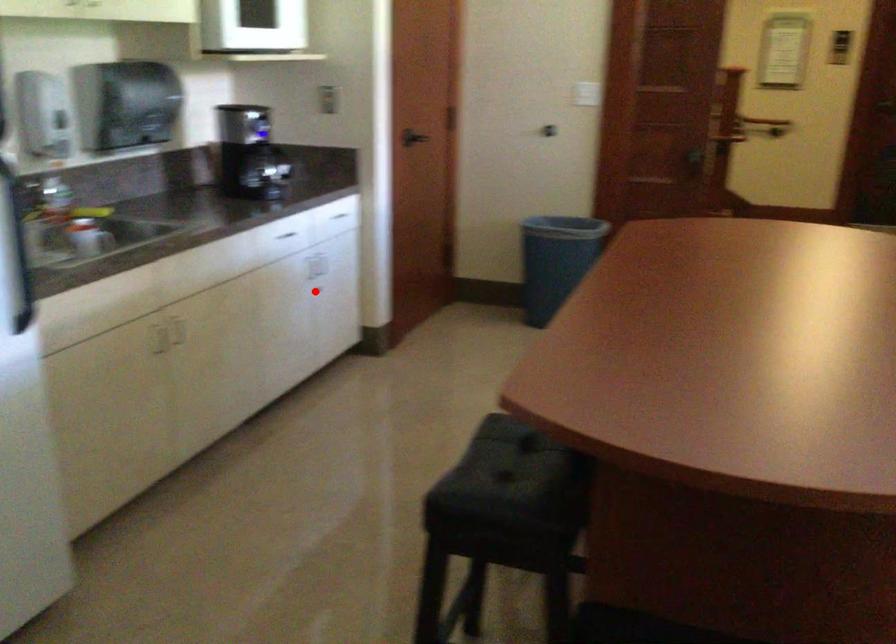
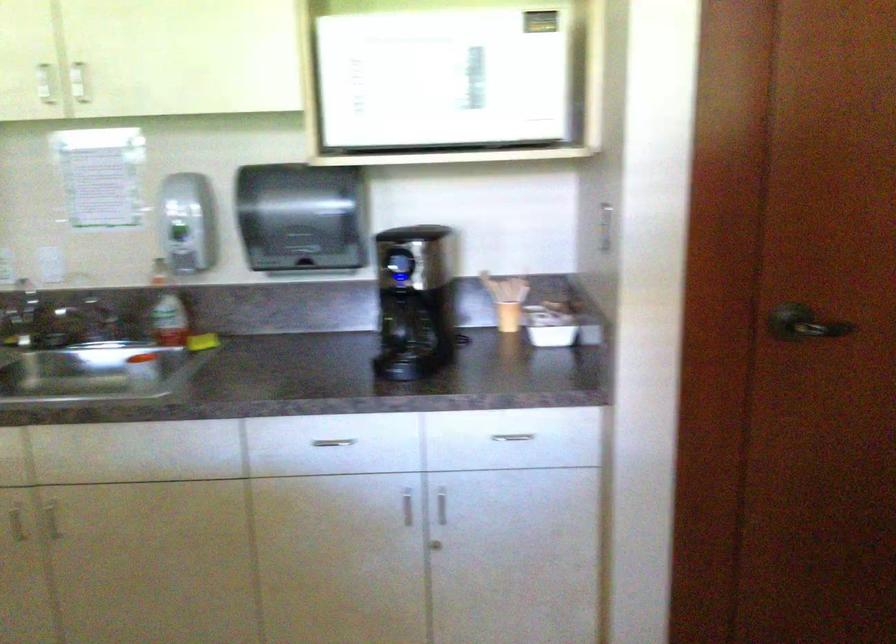
The point at the highlighted location is marked in the first image. Where is the corresponding point in the second image?

(435, 545)